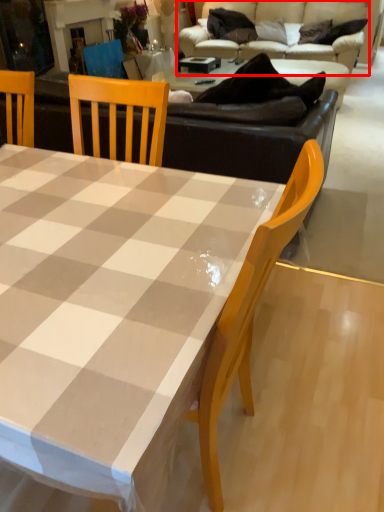
Question: From the image's perspective, what is the correct spatial positioning of studio couch (annotated by the red box) in reference to coffee table?

Choices:
 (A) above
 (B) below

Answer: (A)